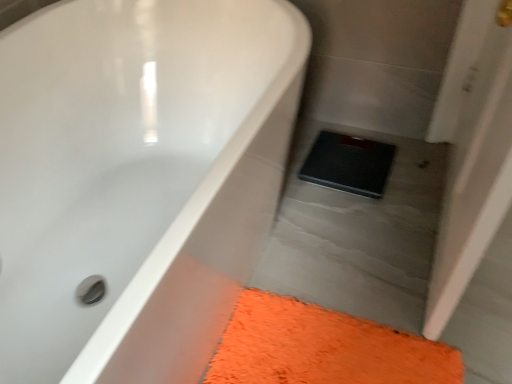
This screenshot has width=512, height=384. Find the location of `free area in between black rubber scale at center and orange shaggy bath mat at lower right`. free area in between black rubber scale at center and orange shaggy bath mat at lower right is located at coordinates [x=356, y=248].